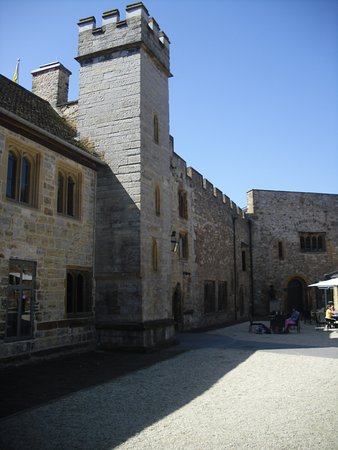
What are the coordinates of `black design or text written in an arc above window with four sections` in the screenshot? It's located at (308, 220).